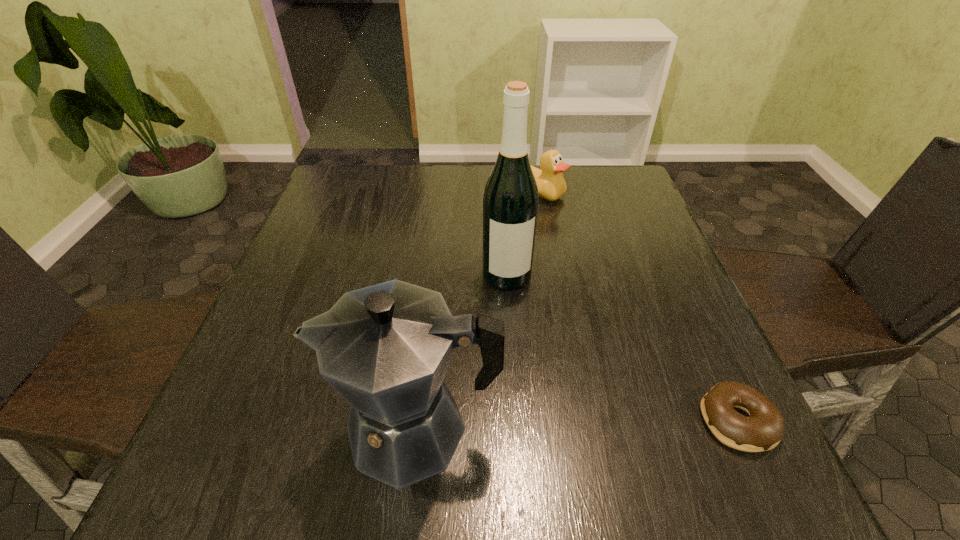
I want to click on free space on the desktop that is between the coffeepot and the shortest object and is positioned on the label of the second farthest object, so click(x=537, y=426).

You are a GUI agent. You are given a task and a screenshot of the screen. Output one action in this format:
    pyautogui.click(x=<x>, y=<y>)
    Task: Click on the free space on the desktop that is between the coffeepot and the rightmost object and is positioned at the beak of the duck
    
    Given the screenshot: What is the action you would take?
    pyautogui.click(x=610, y=424)